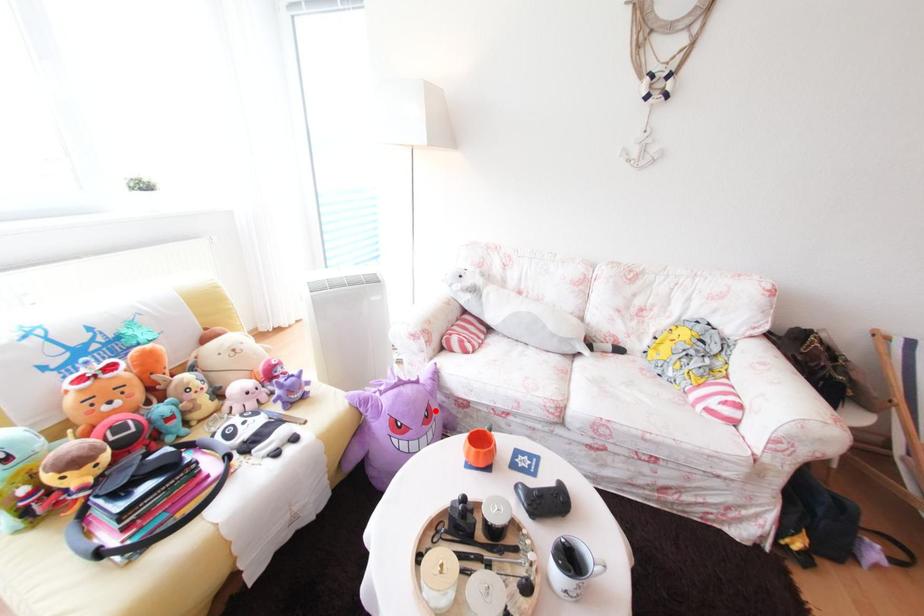
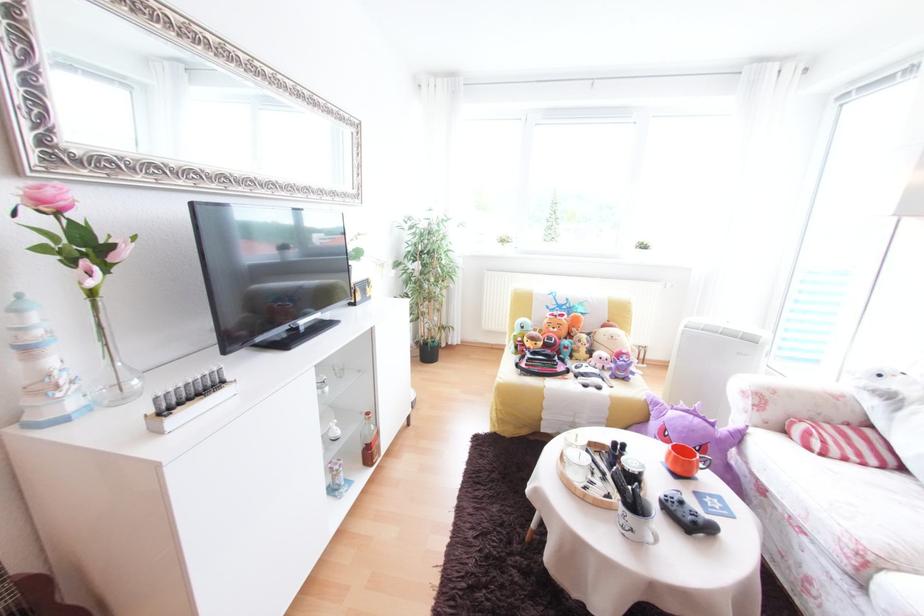
Question: A red point is marked in image1. In image2, is the corresponding 3D point closer to the camera or farther? Reply with the corresponding letter.

Choices:
 (A) The corresponding 3D point is closer.
 (B) The corresponding 3D point is farther.

Answer: (B)